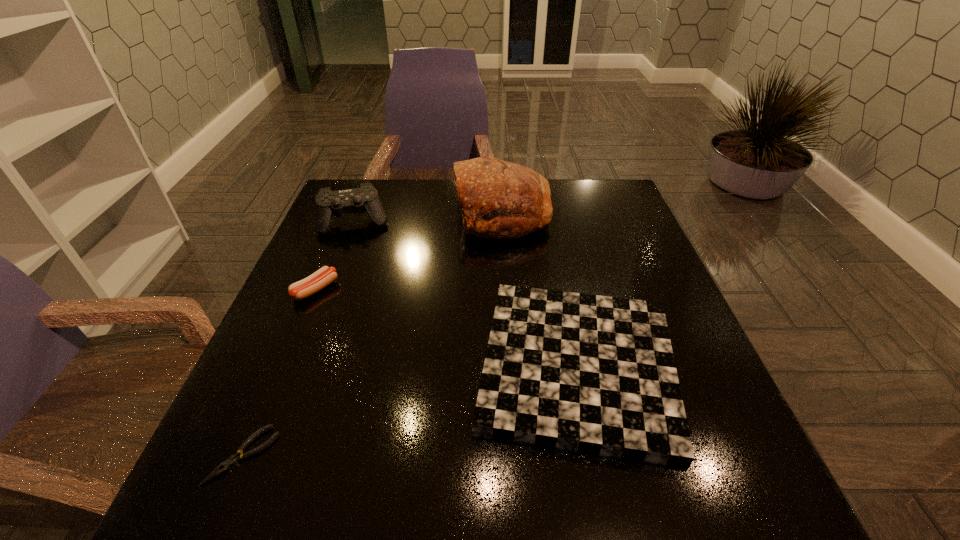
This screenshot has width=960, height=540. Find the location of `vacant position in the image that satisfies the following two spatial constraints: 1. at the sliced front of the tallest object; 2. on the front side of the sausage`. vacant position in the image that satisfies the following two spatial constraints: 1. at the sliced front of the tallest object; 2. on the front side of the sausage is located at coordinates (508, 289).

Identify the location of free space that satisfies the following two spatial constraints: 1. on the front side of the checkerboard; 2. on the left side of the sausage. Image resolution: width=960 pixels, height=540 pixels. (283, 367).

The height and width of the screenshot is (540, 960). Identify the location of vacant region that satisfies the following two spatial constraints: 1. at the sliced front of the tallest object; 2. on the front side of the sausage. (508, 289).

You are a GUI agent. You are given a task and a screenshot of the screen. Output one action in this format:
    pyautogui.click(x=<x>, y=<y>)
    Task: Click on the vacant space that satisfies the following two spatial constraints: 1. on the back side of the checkerboard; 2. at the sliced front of the bread
    
    Given the screenshot: What is the action you would take?
    pyautogui.click(x=545, y=213)